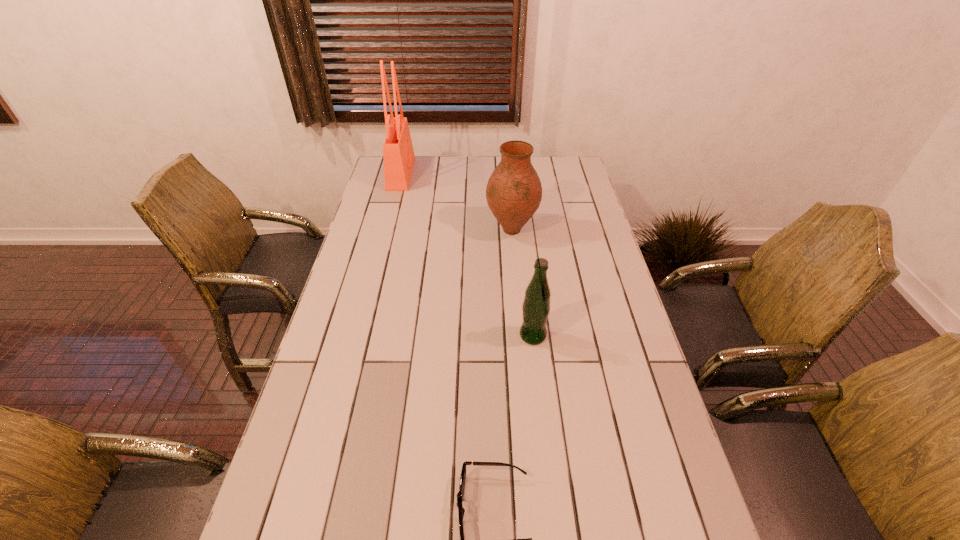
Identify which object is located as the second nearest to the vase. Please provide its 2D coordinates. Your answer should be formatted as a tuple, i.e. [(x, y)], where the tuple contains the x and y coordinates of a point satisfying the conditions above.

[(536, 306)]

The image size is (960, 540). I want to click on vacant area in the image that satisfies the following two spatial constraints: 1. on the back side of the vase; 2. on the logo side of the farthest object, so click(507, 174).

The height and width of the screenshot is (540, 960). In order to click on vacant region that satisfies the following two spatial constraints: 1. on the logo side of the second farthest object; 2. on the right side of the tallest object in this screenshot , I will do `click(387, 230)`.

Identify the location of vacant space that satisfies the following two spatial constraints: 1. on the logo side of the farthest object; 2. on the right side of the beer bottle. This screenshot has height=540, width=960. (359, 335).

At what (x,y) coordinates should I click in order to perform the action: click on blank space that satisfies the following two spatial constraints: 1. on the logo side of the tallest object; 2. on the left side of the beer bottle. Please return your answer as a coordinate pair (x, y). This screenshot has width=960, height=540. Looking at the image, I should click on (359, 335).

Locate an element on the screen. This screenshot has width=960, height=540. free space that satisfies the following two spatial constraints: 1. on the logo side of the third farthest object; 2. on the left side of the tallest object is located at coordinates (359, 335).